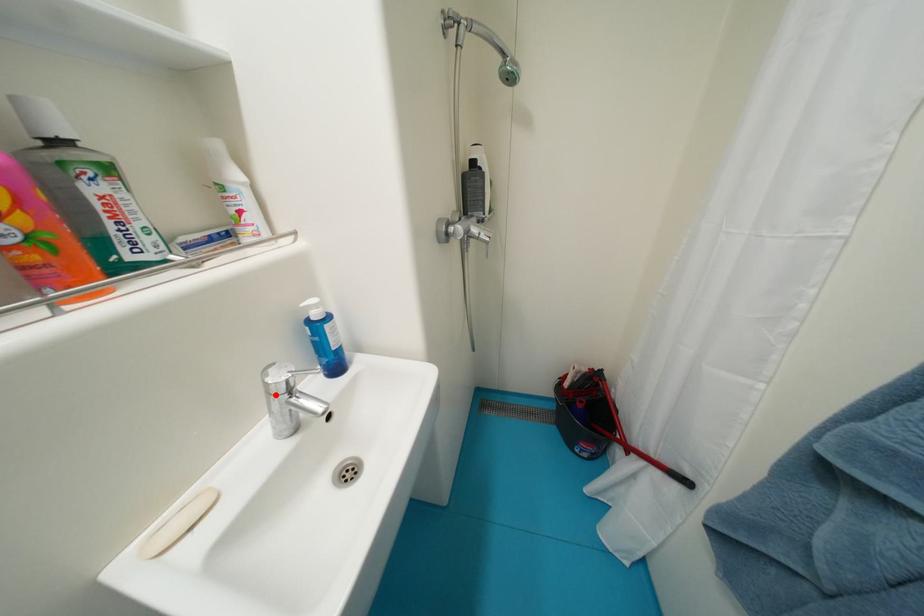
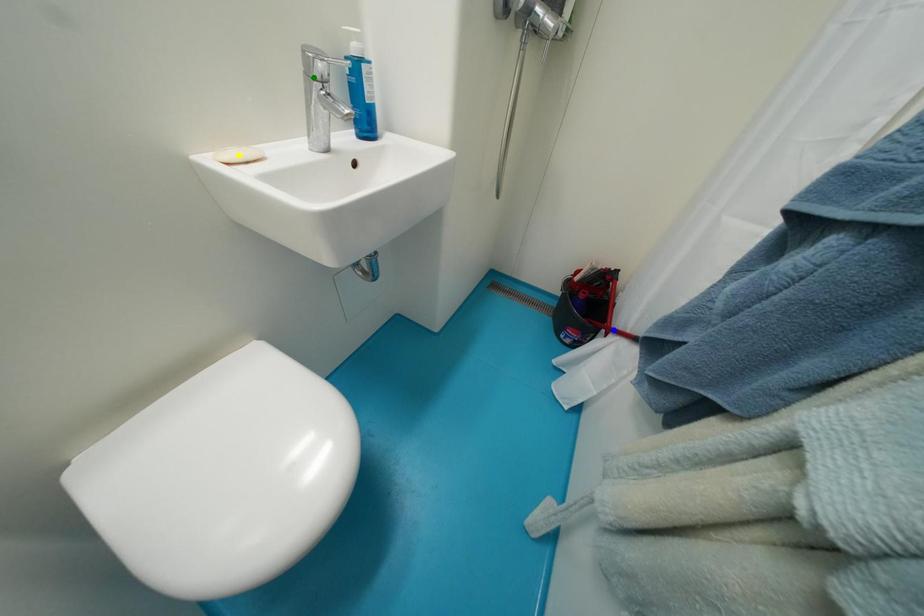
Question: I am providing you with two images of the same scene from different viewpoints. A red point is marked on the first image. You are given multiple points on the second image. Can you choose the point in image 2 that corresponds to the point in image 1?

Choices:
 (A) blue point
 (B) green point
 (C) yellow point

Answer: (B)